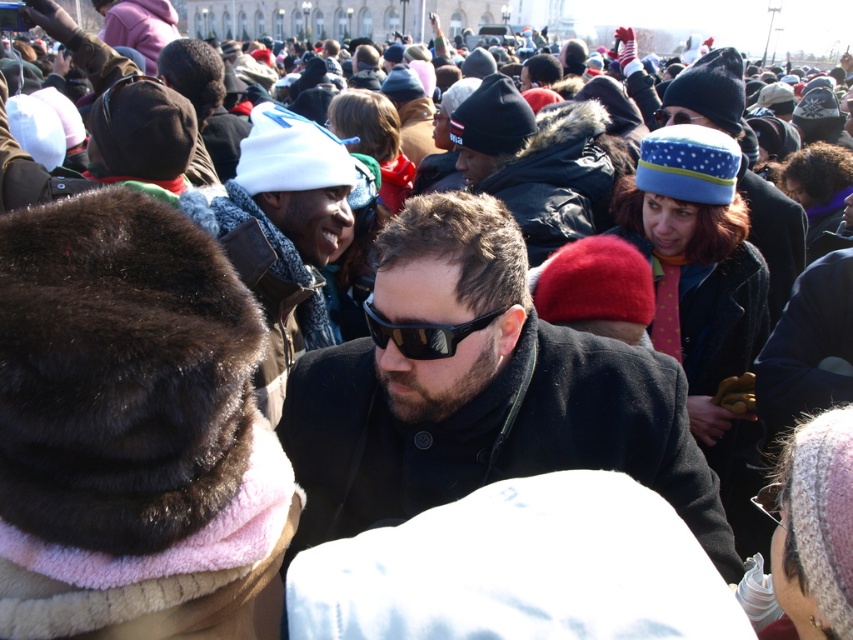
You are a photographer trying to capture a clear shot of both the white knit hat at upper center and the black reflective sunglasses at center. Since you can only focus on one object at a time, which one should you focus on first to ensure the other remains in the background?

You should focus on the black reflective sunglasses at center first because the white knit hat at upper center is located above it and will naturally appear in the background if the sunglasses are in focus.

You are a photographer trying to capture a clear shot of the black reflective sunglasses at center. However, the black matte coat at center is blocking your view. Based on their sizes, do you think you can adjust your angle slightly to get a clear shot without moving the subjects?

The black matte coat at center might be wider than black reflective sunglasses at center, so adjusting your angle slightly might allow you to capture the sunglasses without obstruction, as the coat is likely broader and provides more space to maneuver around.

Based on the photo, you are standing at the center of the crowd in the image. There is a black matte coat at center located at point (479, 390). If you want to reach this coat, which direction should you move relative to your current position?

Since the black matte coat at center is located exactly at your current position at point (479, 390), you don not need to move in any direction to reach it.